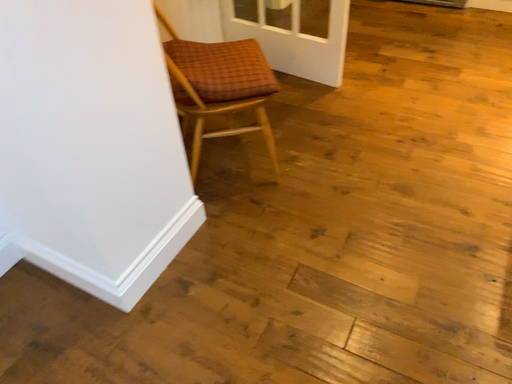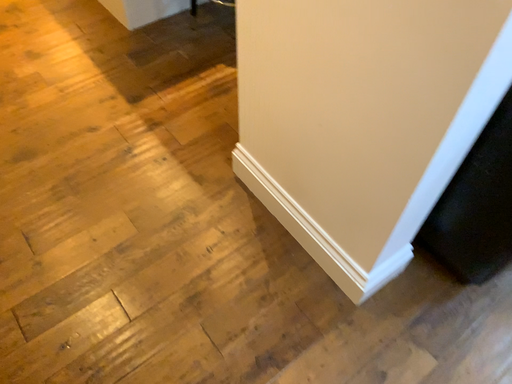
Question: Which way did the camera rotate in the video?

Choices:
 (A) rotated right
 (B) rotated left

Answer: (A)